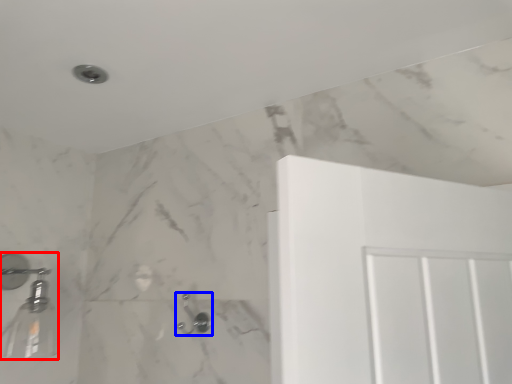
Question: Which point is closer to the camera, shower (highlighted by a red box) or shower (highlighted by a blue box)?

Choices:
 (A) shower
 (B) shower

Answer: (A)